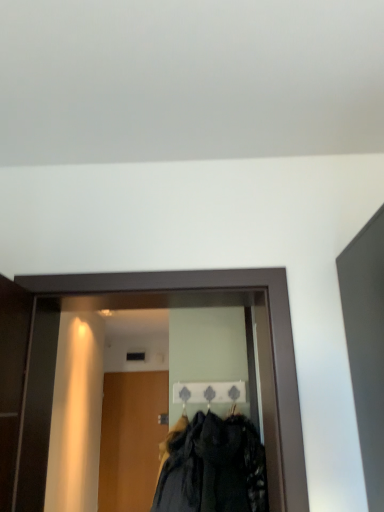
This screenshot has width=384, height=512. In order to click on wooden door at center in this screenshot , I will do `click(131, 439)`.

What do you see at coordinates (131, 439) in the screenshot?
I see `wooden door at center` at bounding box center [131, 439].

The image size is (384, 512). In order to click on wooden door at center in this screenshot , I will do `click(131, 439)`.